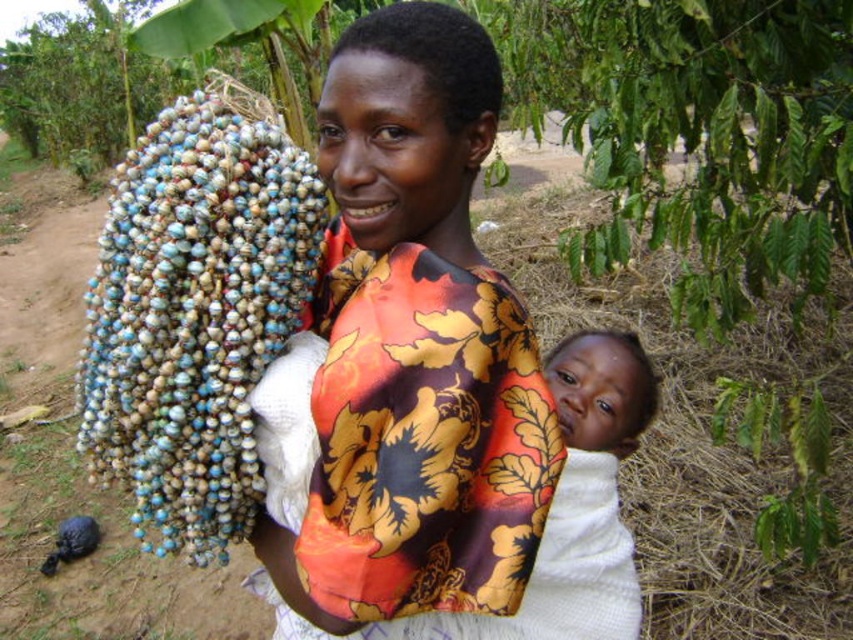
Does floral silk blouse at center appear under beaded necklace at left?

Incorrect, floral silk blouse at center is not positioned below beaded necklace at left.

In order to click on floral silk blouse at center in this screenshot , I will do `click(415, 346)`.

The image size is (853, 640). In order to click on floral silk blouse at center in this screenshot , I will do `click(415, 346)`.

Between point (160, 472) and point (370, 624), which one is positioned behind?

The point (160, 472) is more distant.

In the scene shown: Who is more forward, (148, 282) or (279, 632)?

Point (148, 282) is more forward.

You are a GUI agent. You are given a task and a screenshot of the screen. Output one action in this format:
    pyautogui.click(x=<x>, y=<y>)
    Task: Click on the beaded necklace at left
    The image size is (853, 640).
    Given the screenshot: What is the action you would take?
    pyautogui.click(x=194, y=316)

Is floral silk blouse at center above white knitted cloth at center?

Correct, floral silk blouse at center is located above white knitted cloth at center.

Does point (465, 93) lie in front of point (538, 548)?

Yes, point (465, 93) is closer to viewer.

Where is `floral silk blouse at center`? The height and width of the screenshot is (640, 853). floral silk blouse at center is located at coordinates (415, 346).